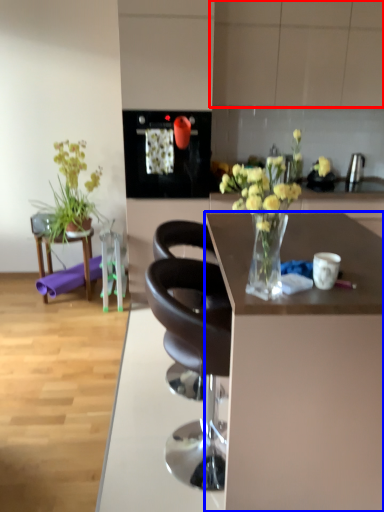
Question: Which object appears closest to the camera in this image, cabinetry (highlighted by a red box) or desk (highlighted by a blue box)?

Choices:
 (A) cabinetry
 (B) desk

Answer: (B)